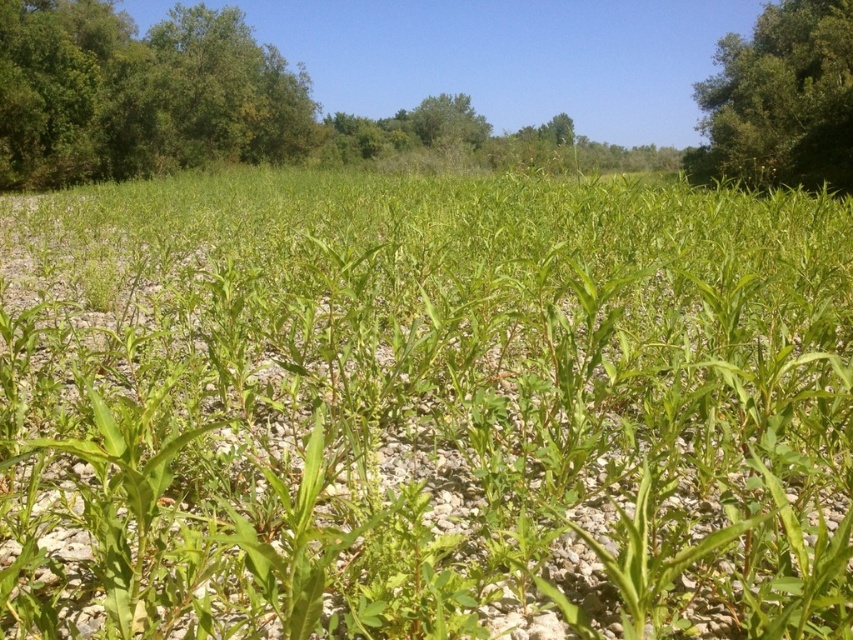
Between green leafy corn at center and green leafy tree at upper right, which one has more height?

green leafy tree at upper right is taller.

Is green leafy corn at center in front of green leafy tree at upper right?

Yes.

This screenshot has height=640, width=853. Find the location of `green leafy corn at center`. green leafy corn at center is located at coordinates (424, 408).

This screenshot has height=640, width=853. What are the coordinates of `green leafy corn at center` in the screenshot? It's located at (424, 408).

From the picture: Is green leafy corn at center positioned before green leafy tree at upper left?

Yes, green leafy corn at center is in front of green leafy tree at upper left.

From the picture: Which is above, green leafy corn at center or green leafy tree at upper left?

green leafy tree at upper left is higher up.

Does point (450, 317) come in front of point (134, 160)?

Yes, it is in front of point (134, 160).

At what (x,y) coordinates should I click in order to perform the action: click on green leafy corn at center. Please return your answer as a coordinate pair (x, y). The height and width of the screenshot is (640, 853). Looking at the image, I should click on (424, 408).

Who is shorter, green leafy tree at upper left or green leafy tree at upper right?

green leafy tree at upper right is shorter.

Is green leafy tree at upper left wider than green leafy tree at upper right?

Correct, the width of green leafy tree at upper left exceeds that of green leafy tree at upper right.

I want to click on green leafy tree at upper left, so click(x=138, y=93).

I want to click on green leafy tree at upper left, so click(138, 93).